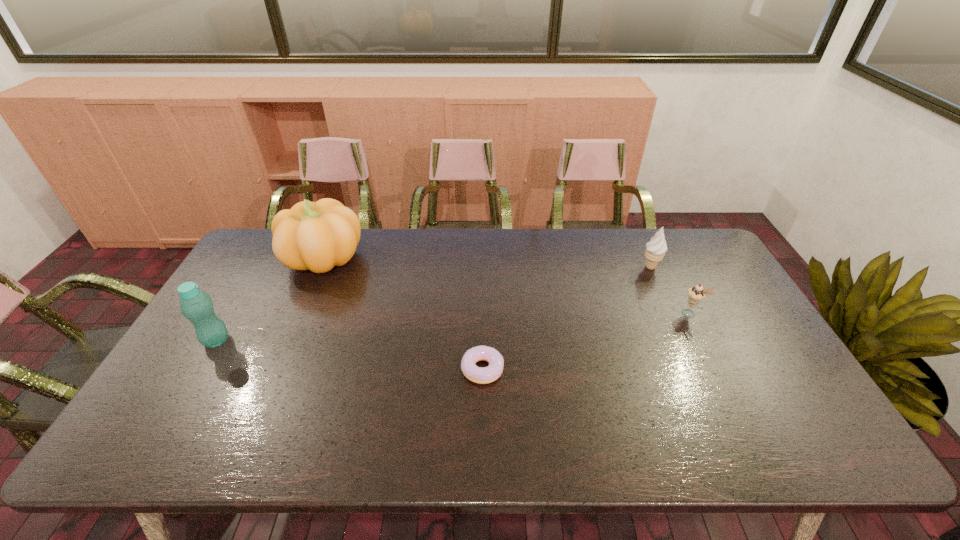
Locate an element on the screen. This screenshot has height=540, width=960. free region at the far edge is located at coordinates (447, 247).

Find the location of `free region at the near edge of the desktop`. free region at the near edge of the desktop is located at coordinates (665, 428).

The image size is (960, 540). I want to click on free location at the left edge of the desktop, so coord(276,283).

In the image, there is a desktop. Where is `vacant space at the right edge`? vacant space at the right edge is located at coordinates (766, 420).

Find the location of a particular element. free space at the far right corner is located at coordinates (x=700, y=234).

The image size is (960, 540). I want to click on free space at the near right corner of the desktop, so click(x=765, y=437).

Identify the location of free space between the third object from right to left and the farther icecream. This screenshot has height=540, width=960. (566, 318).

I want to click on free spot between the leftmost object and the nearer icecream, so click(453, 327).

Identify the location of free space that is in between the taller icecream and the shorter icecream. The image size is (960, 540). (670, 290).

Identify the location of unoccupied position between the doughnut and the leftmost object. The width and height of the screenshot is (960, 540). (349, 355).